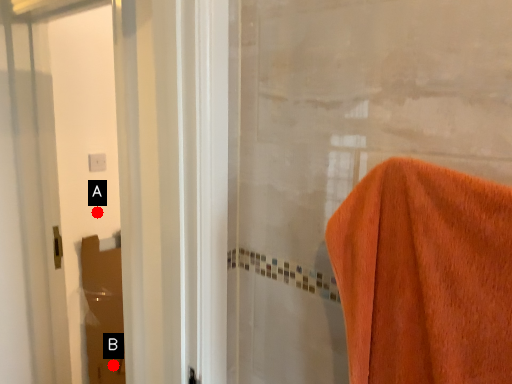
Question: Two points are circled on the image, labeled by A and B beside each circle. Which point is closer to the camera taking this photo?

Choices:
 (A) A is closer
 (B) B is closer

Answer: (A)